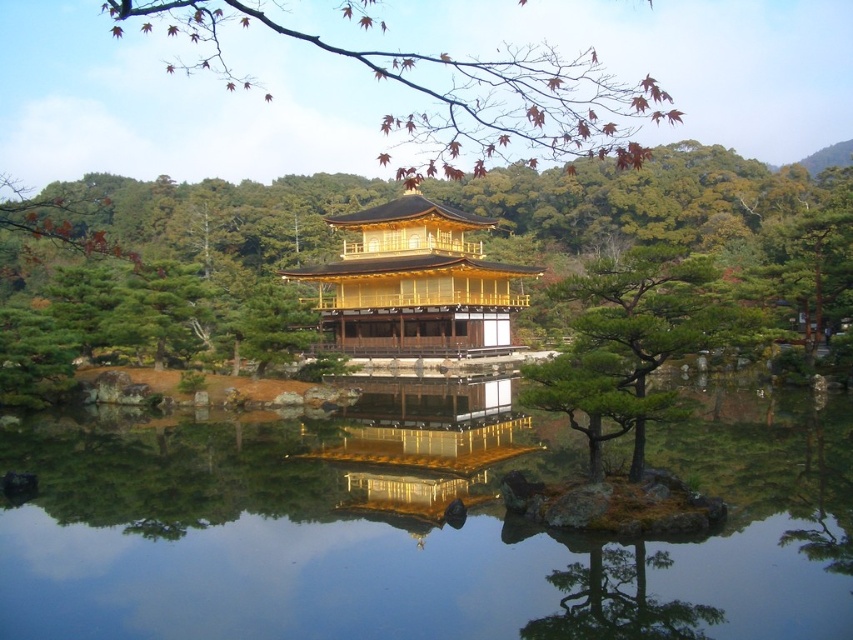
From the picture: You are a visitor at Kinkakuji and want to take a photo that includes both the transparent water at center and the green textured tree at center. Since the pavilion itself is in the middle ground, which of the two objects should you focus on to ensure both are in the frame?

You should focus on the green textured tree at center because it occupies more space than the transparent water at center, making it easier to frame both in the photo.

You are a visitor at Kinkakuji and want to take a photo of the transparent water at center and the green textured pine tree at center. Can you fit both in your camera frame if your camera has a maximum field of view of 200 feet?

The transparent water at center and green textured pine tree at center are 215.82 feet apart, which exceeds the camera frame of 200 feet. Therefore, both cannot be captured in a single photo.

You are standing in front of the Kinkakuji pavilion and want to place a small decorative stone at the point exactly 30 meters away from where you are standing. The point you need to place the stone is marked as point (759, 461). Can you confirm if the distance matches your requirement?

The point (759, 461) is 29.81 meters from the viewer, which is very close to 30 meters. Therefore, placing the stone there would meet the requirement.